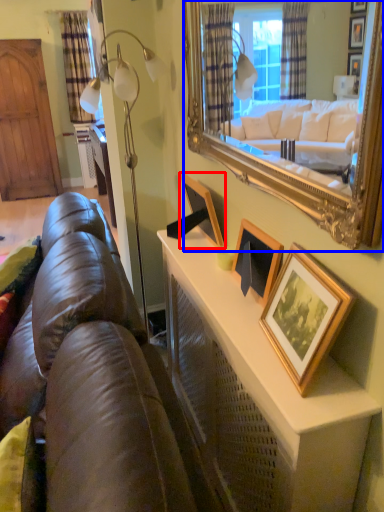
Question: Which object is further to the camera taking this photo, picture frame (highlighted by a red box) or mirror (highlighted by a blue box)?

Choices:
 (A) picture frame
 (B) mirror

Answer: (A)